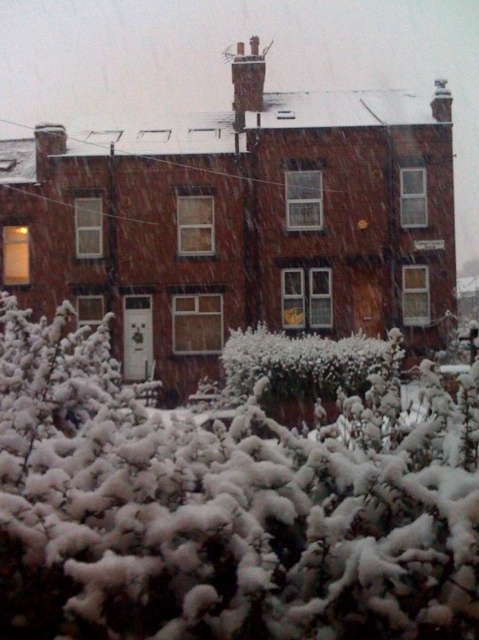
Question: Is white fluffy bush at lower center further to the viewer compared to white fluffy bush at center?

Choices:
 (A) yes
 (B) no

Answer: (B)

Question: Which point appears farthest from the camera in this image?

Choices:
 (A) (362, 616)
 (B) (332, 413)

Answer: (B)

Question: Which object appears closest to the camera in this image?

Choices:
 (A) white fluffy bush at center
 (B) white fluffy bush at lower center

Answer: (B)

Question: Does white fluffy bush at lower center have a greater width compared to white fluffy bush at center?

Choices:
 (A) yes
 (B) no

Answer: (A)

Question: Where is white fluffy bush at lower center located in relation to white fluffy bush at center in the image?

Choices:
 (A) above
 (B) below

Answer: (A)